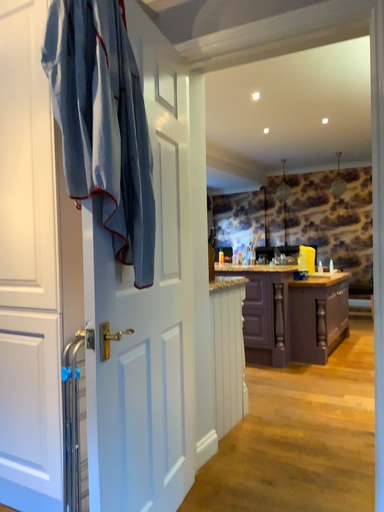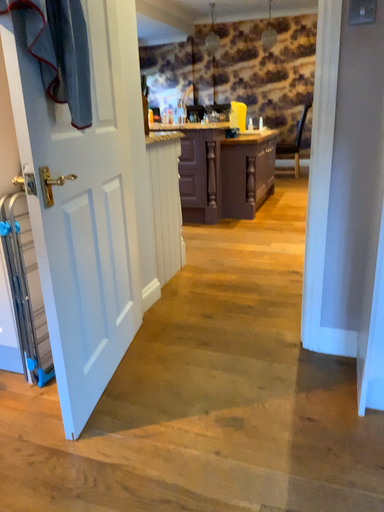
Question: Which way did the camera rotate in the video?

Choices:
 (A) rotated right
 (B) rotated left

Answer: (A)